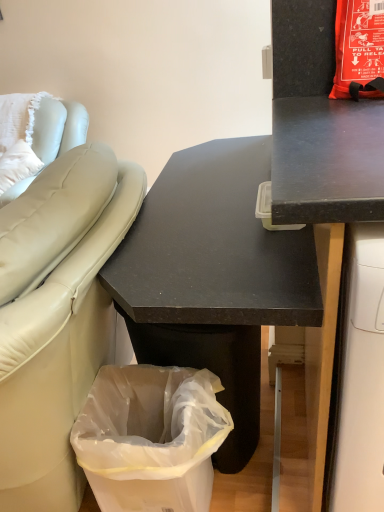
Locate an element on the screen. The width and height of the screenshot is (384, 512). empty space that is ontop of black matte desk at center, positioned as the second desk in right-to-left order (from a real-world perspective) is located at coordinates (218, 196).